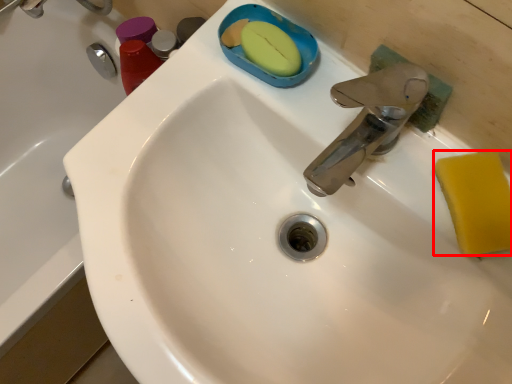
Question: In this image, where is soap (annotated by the red box) located relative to bath?

Choices:
 (A) right
 (B) left

Answer: (A)